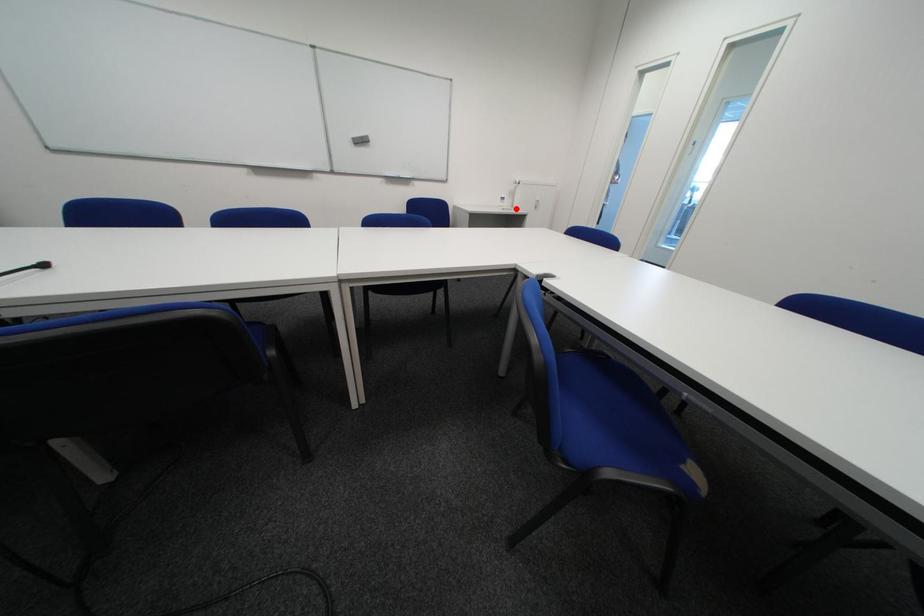
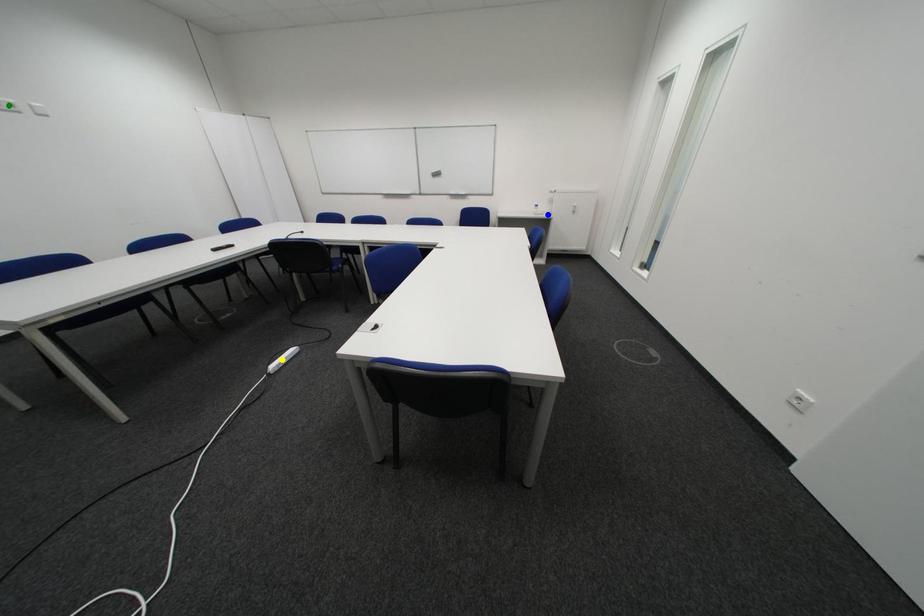
Question: I am providing you with two images of the same scene from different viewpoints. A red point is marked on the first image. You are given multiple points on the second image. In image 2, which mark is for the same physical point as the one in image 1?

Choices:
 (A) blue point
 (B) green point
 (C) yellow point

Answer: (A)